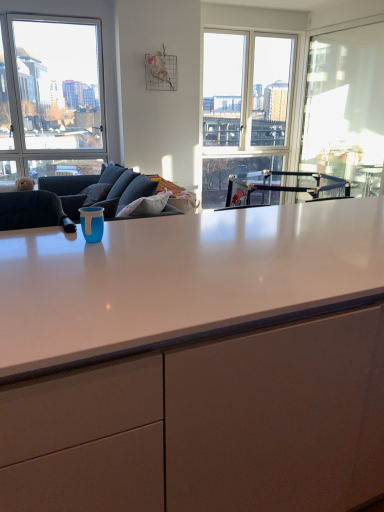
Find the location of a particular element. The image size is (384, 512). white glossy cabinet at center is located at coordinates (207, 426).

What's the angular difference between white glossy cabinet at center and clear glass window at upper left's facing directions?

There is a 8.65-degree angle between the facing directions of white glossy cabinet at center and clear glass window at upper left.

Based on their positions, is white glossy cabinet at center located to the left or right of clear glass window at upper left?

white glossy cabinet at center is positioned on clear glass window at upper left's right side.

From the image's perspective, between white glossy cabinet at center and clear glass window at upper left, who is located below?

→ white glossy cabinet at center appears lower in the image.

Based on the photo, is white glossy cabinet at center positioned beyond the bounds of clear glass window at upper left?

That's correct, white glossy cabinet at center is outside of clear glass window at upper left.

Who is taller, white glossy cabinet at center or transparent glass window screen at right?

Standing taller between the two is transparent glass window screen at right.

From the image's perspective, is white glossy cabinet at center located above or below transparent glass window screen at right?

From the image's perspective, white glossy cabinet at center appears below transparent glass window screen at right.

You are a GUI agent. You are given a task and a screenshot of the screen. Output one action in this format:
    pyautogui.click(x=<x>, y=<y>)
    Task: Click on the window screen behind the white glossy cabinet at center
    The width and height of the screenshot is (384, 512).
    Given the screenshot: What is the action you would take?
    pyautogui.click(x=346, y=106)

Looking at the image, does white glossy cabinet at center seem bigger or smaller compared to transparent glass window screen at right?

Considering their sizes, white glossy cabinet at center takes up more space than transparent glass window screen at right.

What's the angular difference between transparent glass window screen at right and white glossy cabinet at center's facing directions?

transparent glass window screen at right and white glossy cabinet at center are facing 90.2 degrees away from each other.

Considering the positions of objects transparent glass window screen at right and white glossy cabinet at center in the image provided, who is more to the left, transparent glass window screen at right or white glossy cabinet at center?

white glossy cabinet at center is more to the left.

This screenshot has width=384, height=512. I want to click on window screen behind the white glossy cabinet at center, so click(x=346, y=106).

Is there a large distance between transparent glass window screen at right and white glossy cabinet at center?

Yes, transparent glass window screen at right and white glossy cabinet at center are quite far apart.

Looking at this image, is clear glass window at upper left further to the viewer compared to transparent glass window screen at right?

Yes, the depth of clear glass window at upper left is greater than that of transparent glass window screen at right.

From the image's perspective, which is above, clear glass window at upper left or transparent glass window screen at right?

clear glass window at upper left appears higher in the image.

What are the coordinates of `window screen that is under the clear glass window at upper left (from a real-world perspective)` in the screenshot? It's located at (346, 106).

Can you confirm if clear glass window at upper left is shorter than transparent glass window screen at right?

No, clear glass window at upper left is not shorter than transparent glass window screen at right.

Is transparent glass window screen at right wider or thinner than clear glass window at upper left?

Clearly, transparent glass window screen at right has less width compared to clear glass window at upper left.

From a real-world perspective, which is physically below, transparent glass window screen at right or clear glass window at upper left?

From a 3D spatial view, transparent glass window screen at right is below.

Is clear glass window at upper left at the back of transparent glass window screen at right?

No, transparent glass window screen at right is not facing away from clear glass window at upper left.

Is point (324, 90) closer or farther from the camera than point (27, 46)?

Point (324, 90).

Considering the sizes of objects clear glass window at upper left and white glossy cabinet at center in the image provided, who is thinner, clear glass window at upper left or white glossy cabinet at center?

clear glass window at upper left.

How many degrees apart are the facing directions of clear glass window at upper left and white glossy cabinet at center?

clear glass window at upper left and white glossy cabinet at center are facing 8.65 degrees away from each other.

Looking at this image, is clear glass window at upper left looking in the opposite direction of white glossy cabinet at center?

clear glass window at upper left is not turned away from white glossy cabinet at center.

Could white glossy cabinet at center be considered to be inside clear glass window at upper left?

No.

Identify the location of cabinetry below the clear glass window at upper left (from a real-world perspective). This screenshot has height=512, width=384. (207, 426).

The image size is (384, 512). In order to click on cabinetry that appears below the transparent glass window screen at right (from the image's perspective) in this screenshot , I will do `click(207, 426)`.

Looking at the image, which one is located closer to clear glass window at upper left, transparent glass window screen at right or white glossy cabinet at center?

The object closer to clear glass window at upper left is transparent glass window screen at right.

When comparing their distances from white glossy cabinet at center, does transparent glass window screen at right or clear glass window at upper left seem further?

Based on the image, clear glass window at upper left appears to be further to white glossy cabinet at center.

Consider the image. Considering their positions, is clear glass window at upper left positioned further to transparent glass window screen at right than white glossy cabinet at center?

white glossy cabinet at center is positioned further to the anchor transparent glass window screen at right.

Estimate the real-world distances between objects in this image. Which object is further from transparent glass window screen at right, white glossy cabinet at center or clear glass window at upper left?

Among the two, white glossy cabinet at center is located further to transparent glass window screen at right.

Estimate the real-world distances between objects in this image. Which object is closer to clear glass window at upper left, white glossy cabinet at center or transparent glass window screen at right?

Based on the image, transparent glass window screen at right appears to be nearer to clear glass window at upper left.

Which object lies further to the anchor point white glossy cabinet at center, clear glass window at upper left or transparent glass window screen at right?

Based on the image, clear glass window at upper left appears to be further to white glossy cabinet at center.

Identify the location of window screen between white glossy cabinet at center and clear glass window at upper left in the front-back direction. Image resolution: width=384 pixels, height=512 pixels. (346, 106).